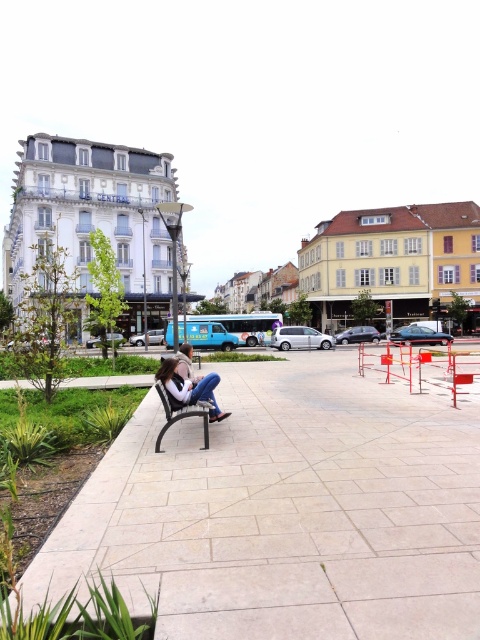
Is point (173, 356) closer to viewer compared to point (159, 429)?

Yes, it is.

Locate an element on the screen. This screenshot has height=640, width=480. denim jeans at lower left is located at coordinates (189, 388).

Is light beige paving stone at center shorter than denim jeans at lower left?

Yes, light beige paving stone at center is shorter than denim jeans at lower left.

Is point (276, 508) less distant than point (219, 410)?

Yes, point (276, 508) is in front of point (219, 410).

Identify the location of light beige paving stone at center. The image size is (480, 640). (287, 512).

Can you confirm if black plastic bench at center is taller than denim jacket at center?

No, black plastic bench at center is not taller than denim jacket at center.

Looking at this image, does black plastic bench at center have a lesser height compared to denim jacket at center?

Yes.

The width and height of the screenshot is (480, 640). What are the coordinates of `black plastic bench at center` in the screenshot? It's located at (179, 417).